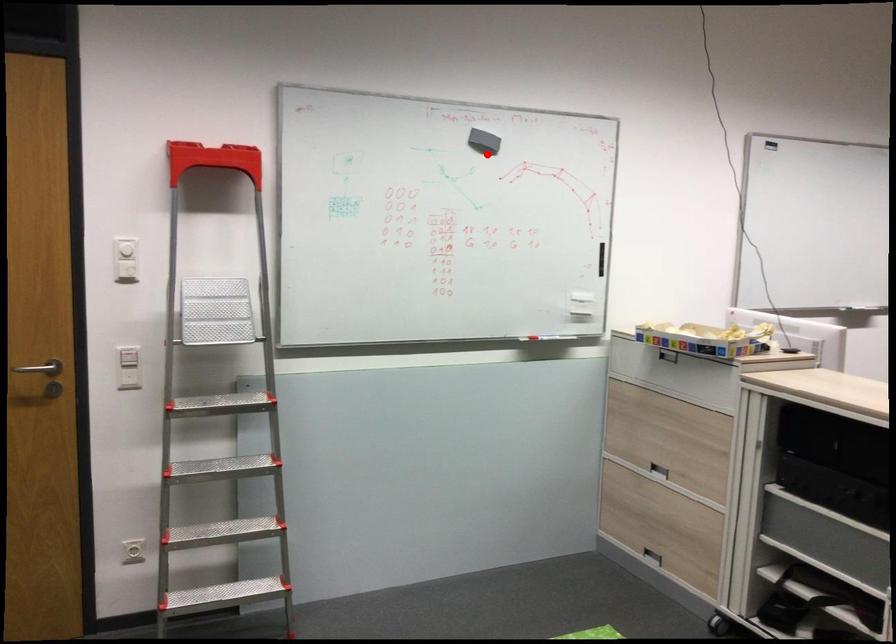
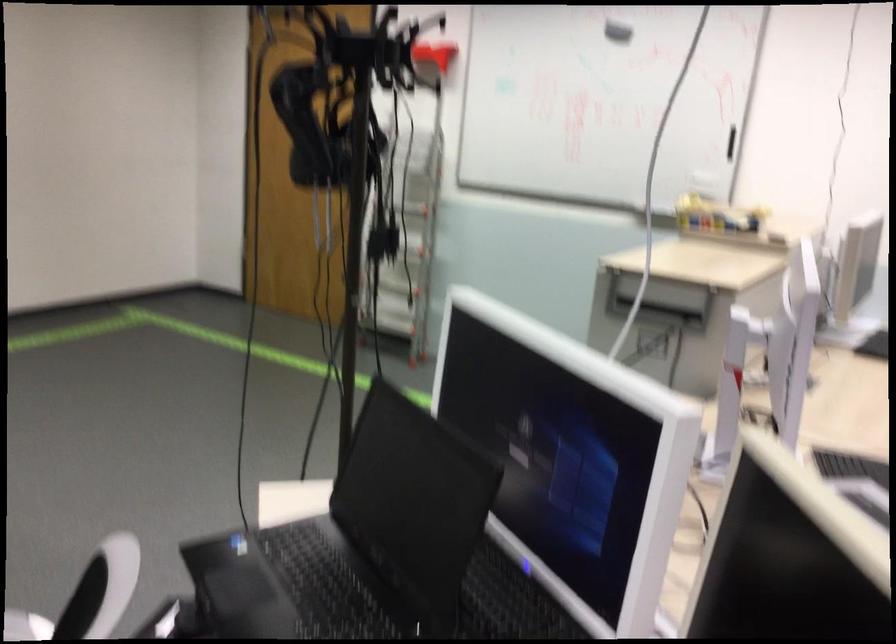
Question: I am providing you with two images of the same scene from different viewpoints. Image1 has a red point marked. In image2, the corresponding 3D location appears at what relative position? Reply with the corresponding letter.

Choices:
 (A) Closer
 (B) Farther

Answer: (B)